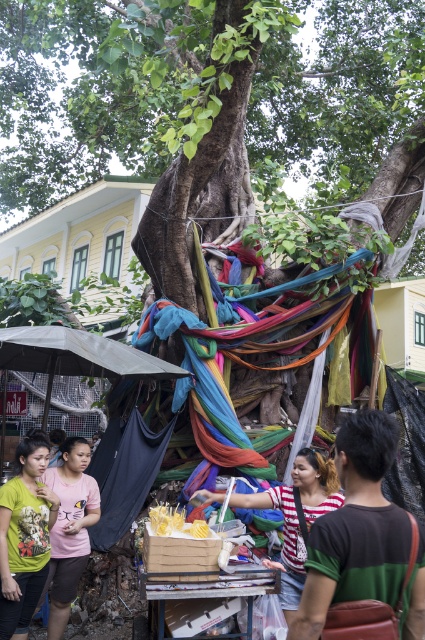
Does striped fabric stall at lower right have a lesser width compared to green printed t-shirt at lower left?

No, striped fabric stall at lower right is not thinner than green printed t-shirt at lower left.

Between striped fabric stall at lower right and green printed t-shirt at lower left, which one is positioned lower?

Positioned lower is green printed t-shirt at lower left.

Image resolution: width=425 pixels, height=640 pixels. Describe the element at coordinates (356, 529) in the screenshot. I see `striped fabric stall at lower right` at that location.

The image size is (425, 640). What are the coordinates of `striped fabric stall at lower right` in the screenshot? It's located at (356, 529).

Can you confirm if striped fabric at center is bigger than pink matte t-shirt at center?

No, striped fabric at center is not bigger than pink matte t-shirt at center.

Who is higher up, striped fabric at center or pink matte t-shirt at center?

Positioned higher is striped fabric at center.

Find the location of a particular element. The width and height of the screenshot is (425, 640). striped fabric at center is located at coordinates (297, 516).

Is striped fabric stall at lower right positioned behind gray fabric canopy at lower left?

No, it is in front of gray fabric canopy at lower left.

Is striped fabric stall at lower right shorter than gray fabric canopy at lower left?

No.

Between point (365, 580) and point (8, 326), which one is positioned behind?

Point (8, 326)

The image size is (425, 640). What are the coordinates of `striped fabric stall at lower right` in the screenshot? It's located at tap(356, 529).